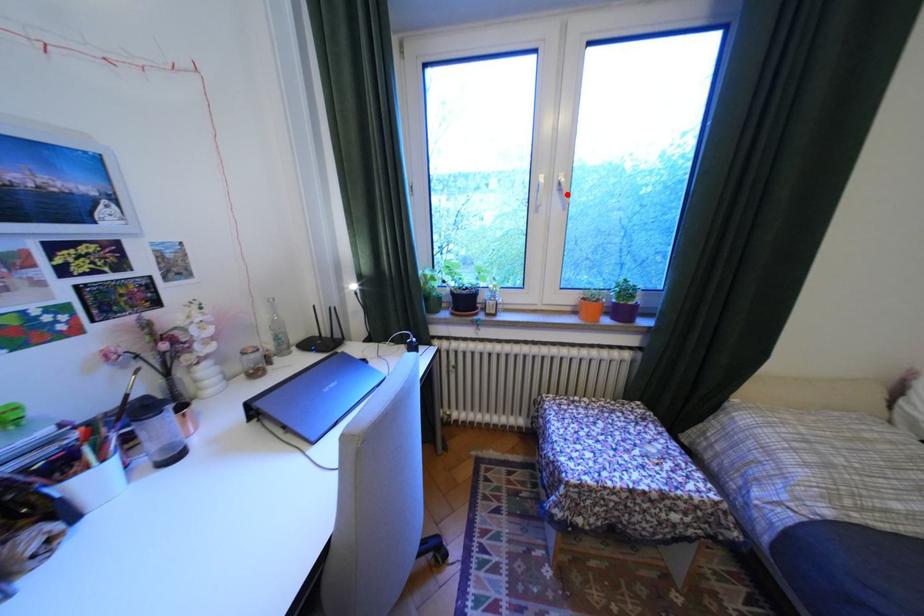
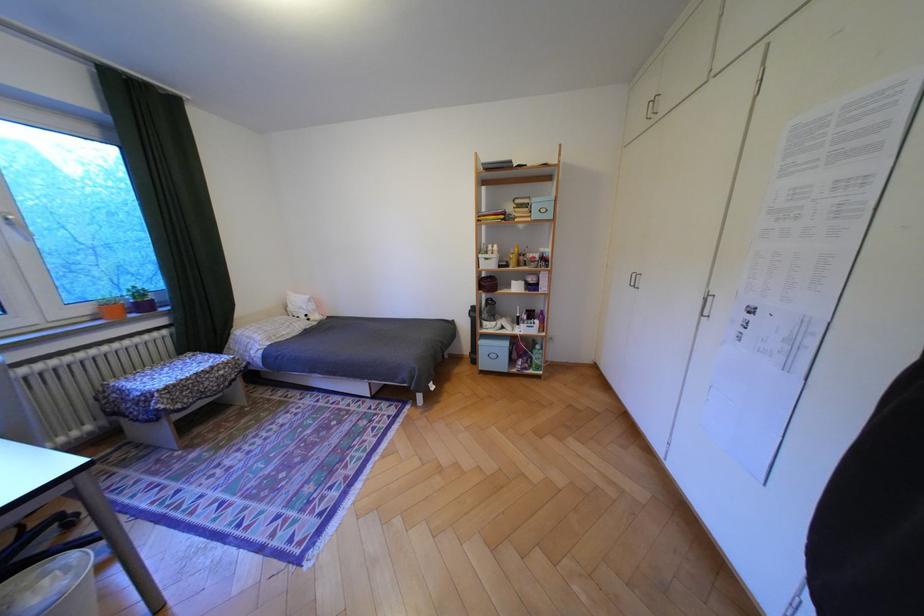
Where in the second image is the point corresponding to the highlighted location from the first image?

(18, 227)